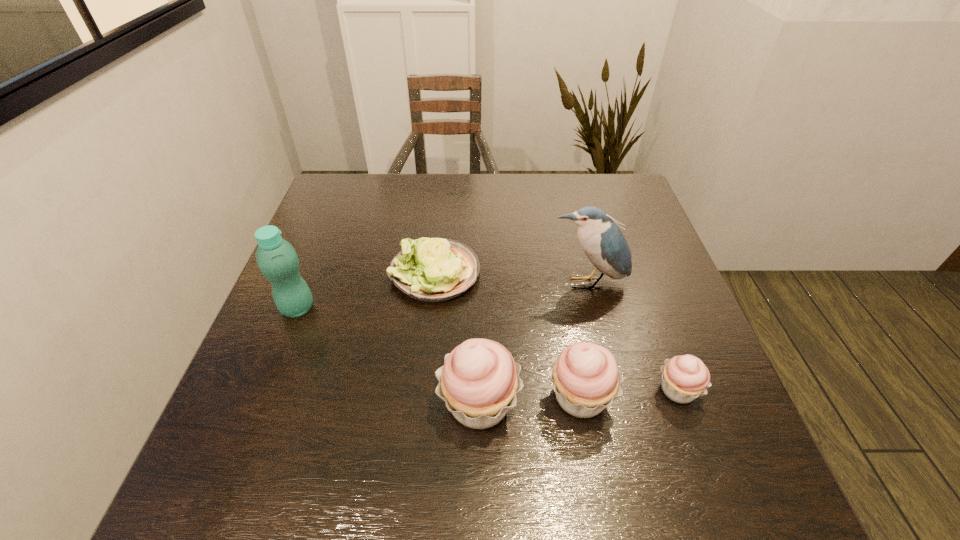
Identify the location of vacant space in between the leftmost cupcake and the water bottle. This screenshot has width=960, height=540. (388, 355).

Where is `vacant area that lies between the bird and the leftmost cupcake`? The height and width of the screenshot is (540, 960). vacant area that lies between the bird and the leftmost cupcake is located at coordinates (533, 343).

What are the coordinates of `vacant area that lies between the second shortest object and the bird` in the screenshot? It's located at (633, 336).

Where is `object that stands as the closest to the shortest object`? The width and height of the screenshot is (960, 540). object that stands as the closest to the shortest object is located at coordinates (276, 258).

Select which object appears as the fifth closest to the rightmost cupcake. Please provide its 2D coordinates. Your answer should be formatted as a tuple, i.e. [(x, y)], where the tuple contains the x and y coordinates of a point satisfying the conditions above.

[(276, 258)]

What are the coordinates of `cupcake that is the second closest one to the leftmost cupcake` in the screenshot? It's located at (684, 378).

This screenshot has height=540, width=960. I want to click on cupcake that is the second closest to the leftmost cupcake, so tap(684, 378).

Identify the location of blank space that satisfies the following two spatial constraints: 1. on the back side of the leftmost cupcake; 2. on the left side of the rightmost cupcake. The image size is (960, 540). (479, 390).

The image size is (960, 540). I want to click on vacant region that satisfies the following two spatial constraints: 1. at the front cap of the leftmost object; 2. on the back side of the third shortest object, so click(262, 396).

I want to click on free space in the image that satisfies the following two spatial constraints: 1. on the back side of the second shortest cupcake; 2. at the front cap of the leftmost object, so (564, 308).